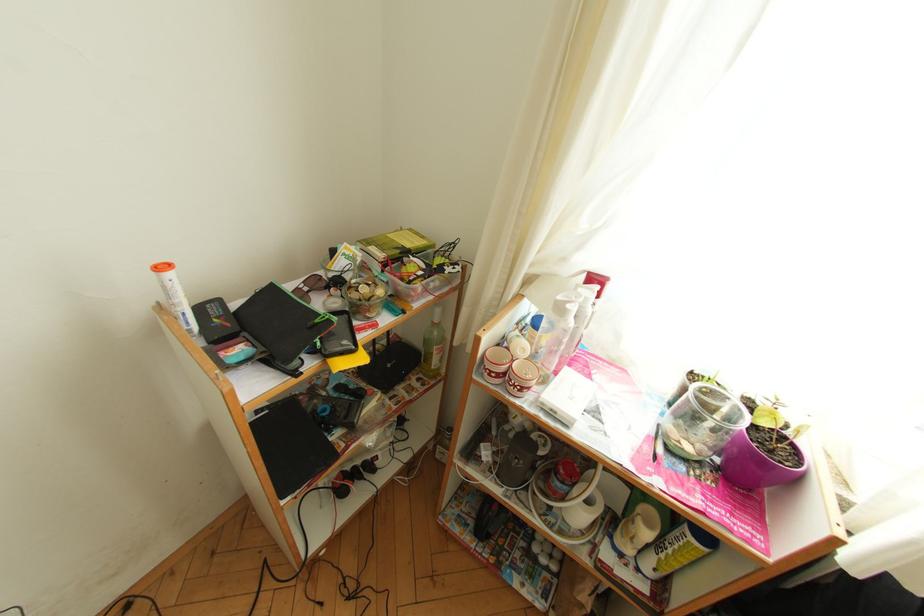
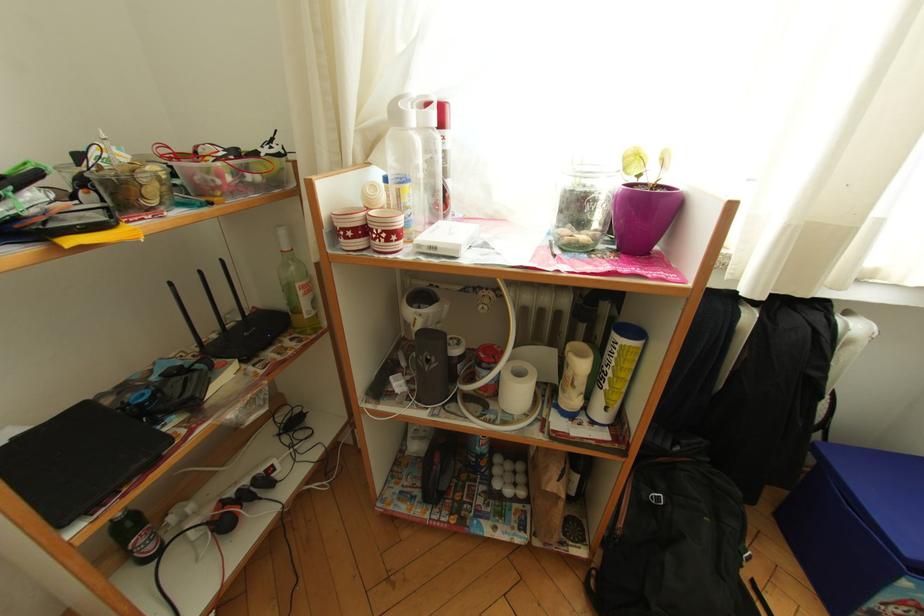
Question: How did the camera likely rotate?

Choices:
 (A) Left
 (B) Right
 (C) Up
 (D) Down

Answer: (B)